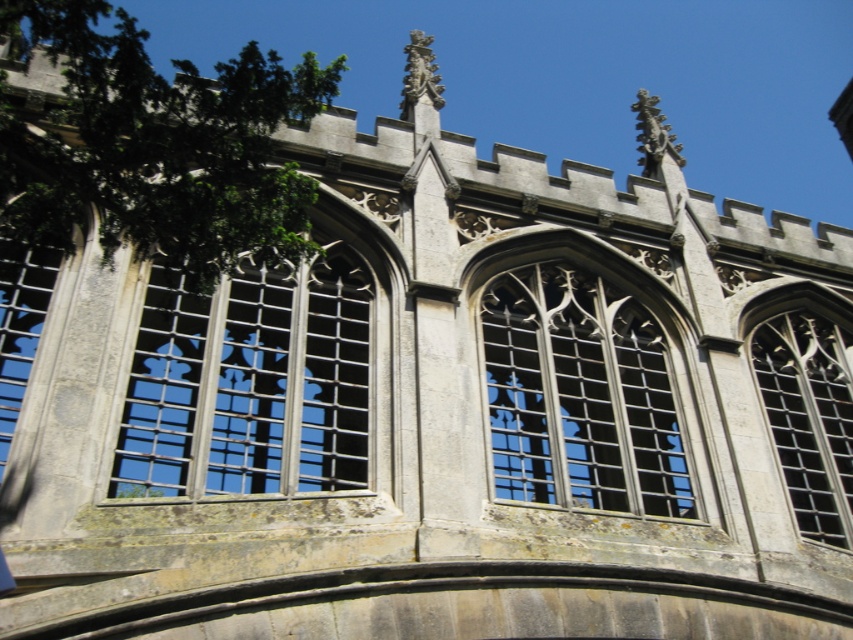
You are an architect examining the historic stone building. You notice the matte stone window at center and the clear stone window at upper right. Which of these two windows has a greater surface area?

The matte stone window at center is larger in size than the clear stone window at upper right, so it has a greater surface area.

You are an architect examining the historic stone building. You notice two windows, the matte stone window at center and the clear stone window at upper right. Which window is located higher up in the structure?

The matte stone window at center is positioned over the clear stone window at upper right, meaning it is higher up in the structure.